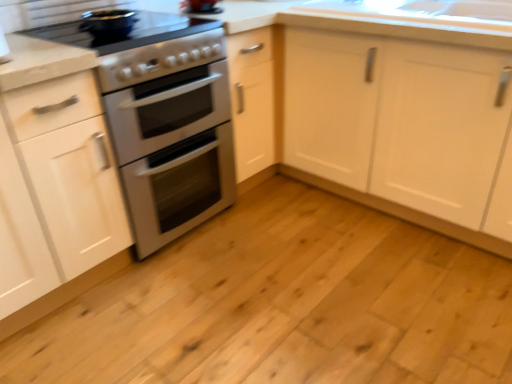
Question: Which direction should I rotate to look at satin silver oven at center, which is the 2th appliance in top-to-bottom order?

Choices:
 (A) left
 (B) right

Answer: (A)

Question: Is matte black pot at upper left, which is counted as the 2th appliance, starting from the bottom, far from satin silver oven at center, which is the 2th appliance in top-to-bottom order?

Choices:
 (A) yes
 (B) no

Answer: (B)

Question: From a real-world perspective, does matte black pot at upper left, which is counted as the 2th appliance, starting from the bottom, stand above satin silver oven at center, which is the 2th appliance in top-to-bottom order?

Choices:
 (A) no
 (B) yes

Answer: (B)

Question: From the image's perspective, does matte black pot at upper left, marked as the 1th appliance in a top-to-bottom arrangement, appear lower than satin silver oven at center, which appears as the first appliance when ordered from the bottom?

Choices:
 (A) no
 (B) yes

Answer: (A)

Question: Does matte black pot at upper left, marked as the 1th appliance in a top-to-bottom arrangement, have a lesser height compared to satin silver oven at center, which appears as the first appliance when ordered from the bottom?

Choices:
 (A) no
 (B) yes

Answer: (B)

Question: Are matte black pot at upper left, which is counted as the 2th appliance, starting from the bottom, and satin silver oven at center, which appears as the first appliance when ordered from the bottom, beside each other?

Choices:
 (A) no
 (B) yes

Answer: (A)

Question: Is the depth of matte black pot at upper left, which is counted as the 2th appliance, starting from the bottom, greater than that of satin silver oven at center, which is the 2th appliance in top-to-bottom order?

Choices:
 (A) no
 (B) yes

Answer: (B)

Question: From a real-world perspective, is natural wood floor at center under white matte cabinet at center, the 1th cabinetry from the right?

Choices:
 (A) yes
 (B) no

Answer: (A)

Question: From the image's perspective, is natural wood floor at center under white matte cabinet at center, which is the second cabinetry from left to right?

Choices:
 (A) yes
 (B) no

Answer: (A)

Question: Is white matte cabinet at center, the 1th cabinetry from the right, inside natural wood floor at center?

Choices:
 (A) yes
 (B) no

Answer: (B)

Question: Considering the relative positions of natural wood floor at center and white matte cabinet at center, which is the second cabinetry from left to right, in the image provided, is natural wood floor at center to the left of white matte cabinet at center, which is the second cabinetry from left to right, from the viewer's perspective?

Choices:
 (A) yes
 (B) no

Answer: (A)

Question: Is natural wood floor at center aimed at white matte cabinet at center, the 1th cabinetry from the right?

Choices:
 (A) yes
 (B) no

Answer: (B)

Question: Are natural wood floor at center and white matte cabinet at center, the 1th cabinetry from the right, far apart?

Choices:
 (A) yes
 (B) no

Answer: (B)

Question: Considering the relative positions of white matte cabinet at left, placed as the 1th cabinetry when sorted from left to right, and matte black pot at upper left, which is counted as the 2th appliance, starting from the bottom, in the image provided, is white matte cabinet at left, placed as the 1th cabinetry when sorted from left to right, to the left of matte black pot at upper left, which is counted as the 2th appliance, starting from the bottom, from the viewer's perspective?

Choices:
 (A) no
 (B) yes

Answer: (B)